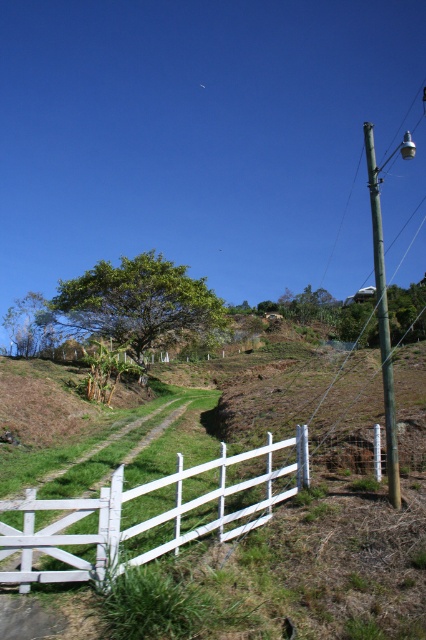
Question: Where is white wooden fence at lower center located in relation to green painted wood pole at right in the image?

Choices:
 (A) below
 (B) above

Answer: (A)

Question: In this image, where is green painted wood pole at right located relative to green leafy tree at left?

Choices:
 (A) below
 (B) above

Answer: (B)

Question: Which object appears farthest from the camera in this image?

Choices:
 (A) green leafy tree at center
 (B) white wooden fence at lower center
 (C) green painted wood pole at right
 (D) green leafy tree at left

Answer: (D)

Question: Is green painted wood pole at right above green leafy tree at left?

Choices:
 (A) yes
 (B) no

Answer: (A)

Question: Which of the following is the farthest from the observer?

Choices:
 (A) (388, 333)
 (B) (37, 332)

Answer: (B)

Question: Which of these objects is positioned farthest from the green painted wood pole at right?

Choices:
 (A) green leafy tree at left
 (B) green leafy tree at center

Answer: (A)